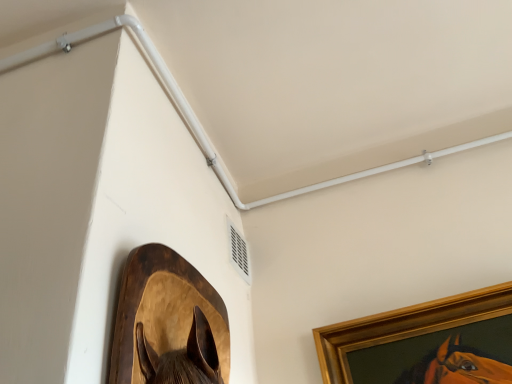
Question: Is white plastic pipe at upper center touching gold wooden picture frame at upper right, acting as the first picture frame starting from the right?

Choices:
 (A) yes
 (B) no

Answer: (B)

Question: From the image's perspective, would you say white plastic pipe at upper center is shown under gold wooden picture frame at upper right, the second picture frame positioned from the left?

Choices:
 (A) no
 (B) yes

Answer: (A)

Question: Does white plastic pipe at upper center have a lesser width compared to gold wooden picture frame at upper right, arranged as the first picture frame when viewed from the back?

Choices:
 (A) no
 (B) yes

Answer: (B)

Question: From a real-world perspective, is white plastic pipe at upper center on gold wooden picture frame at upper right, arranged as the first picture frame when viewed from the back?

Choices:
 (A) no
 (B) yes

Answer: (B)

Question: Does white plastic pipe at upper center appear on the left side of gold wooden picture frame at upper right, arranged as the first picture frame when viewed from the back?

Choices:
 (A) no
 (B) yes

Answer: (B)

Question: Considering the positions of gold wooden picture frame at upper right, the second picture frame positioned from the left, and wooden horse head at lower left, which is the second picture frame in back-to-front order, in the image, is gold wooden picture frame at upper right, the second picture frame positioned from the left, bigger or smaller than wooden horse head at lower left, which is the second picture frame in back-to-front order,?

Choices:
 (A) big
 (B) small

Answer: (A)

Question: Does point (418, 382) appear closer or farther from the camera than point (183, 377)?

Choices:
 (A) farther
 (B) closer

Answer: (A)

Question: Is gold wooden picture frame at upper right, arranged as the first picture frame when viewed from the back, taller or shorter than wooden horse head at lower left, arranged as the 2th picture frame when viewed from the right?

Choices:
 (A) tall
 (B) short

Answer: (A)

Question: Visually, is gold wooden picture frame at upper right, acting as the second picture frame starting from the front, positioned to the left or to the right of wooden horse head at lower left, marked as the first picture frame in a front-to-back arrangement?

Choices:
 (A) left
 (B) right

Answer: (B)

Question: Based on their sizes in the image, would you say white plastic air conditioning unit at upper center is bigger or smaller than gold wooden picture frame at upper right, acting as the second picture frame starting from the front?

Choices:
 (A) big
 (B) small

Answer: (B)

Question: Considering the positions of point (239, 243) and point (487, 296), is point (239, 243) closer or farther from the camera than point (487, 296)?

Choices:
 (A) closer
 (B) farther

Answer: (B)

Question: In terms of width, does white plastic air conditioning unit at upper center look wider or thinner when compared to gold wooden picture frame at upper right, the second picture frame positioned from the left?

Choices:
 (A) thin
 (B) wide

Answer: (A)

Question: Is white plastic air conditioning unit at upper center taller or shorter than gold wooden picture frame at upper right, acting as the second picture frame starting from the front?

Choices:
 (A) tall
 (B) short

Answer: (B)

Question: From a real-world perspective, relative to wooden horse head at lower left, marked as the first picture frame in a front-to-back arrangement, is white plastic air conditioning unit at upper center vertically above or below?

Choices:
 (A) below
 (B) above

Answer: (B)

Question: Is white plastic air conditioning unit at upper center inside the boundaries of wooden horse head at lower left, which is the second picture frame in back-to-front order, or outside?

Choices:
 (A) outside
 (B) inside

Answer: (A)